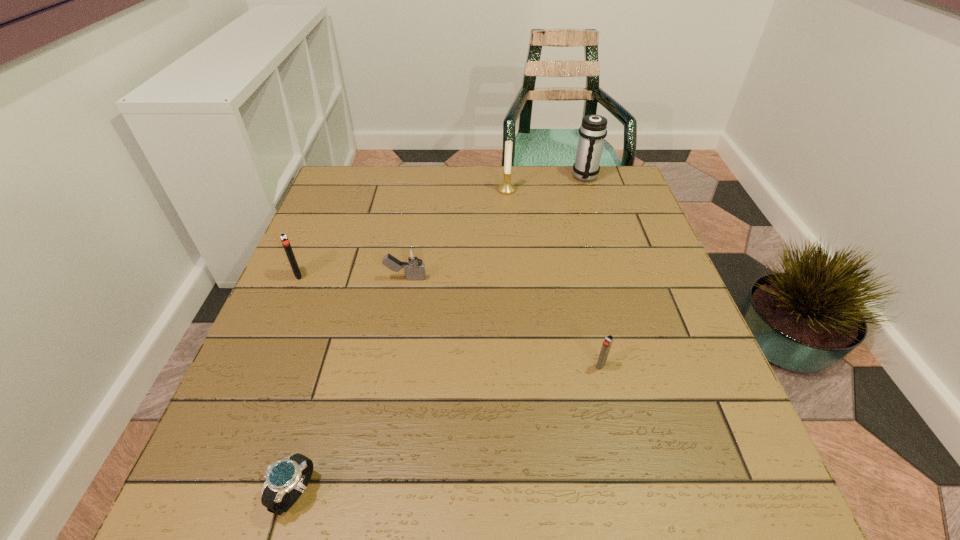
I want to click on the rightmost object, so click(593, 130).

Locate an element on the screen. Image resolution: width=960 pixels, height=540 pixels. candle holder is located at coordinates (506, 188).

The image size is (960, 540). I want to click on the second tallest object, so click(506, 188).

Identify the location of the leftmost igniter. Image resolution: width=960 pixels, height=540 pixels. (283, 237).

Where is `the leftmost object`? Image resolution: width=960 pixels, height=540 pixels. the leftmost object is located at coordinates point(283,237).

This screenshot has width=960, height=540. Find the location of `the third object from left to right`. the third object from left to right is located at coordinates (413, 263).

Where is `the shortest igniter`? Image resolution: width=960 pixels, height=540 pixels. the shortest igniter is located at coordinates (607, 343).

Image resolution: width=960 pixels, height=540 pixels. I want to click on the rightmost igniter, so click(607, 343).

Where is `the nearest object`? The height and width of the screenshot is (540, 960). the nearest object is located at coordinates (291, 475).

What are the coordinates of `watch` in the screenshot? It's located at (291, 475).